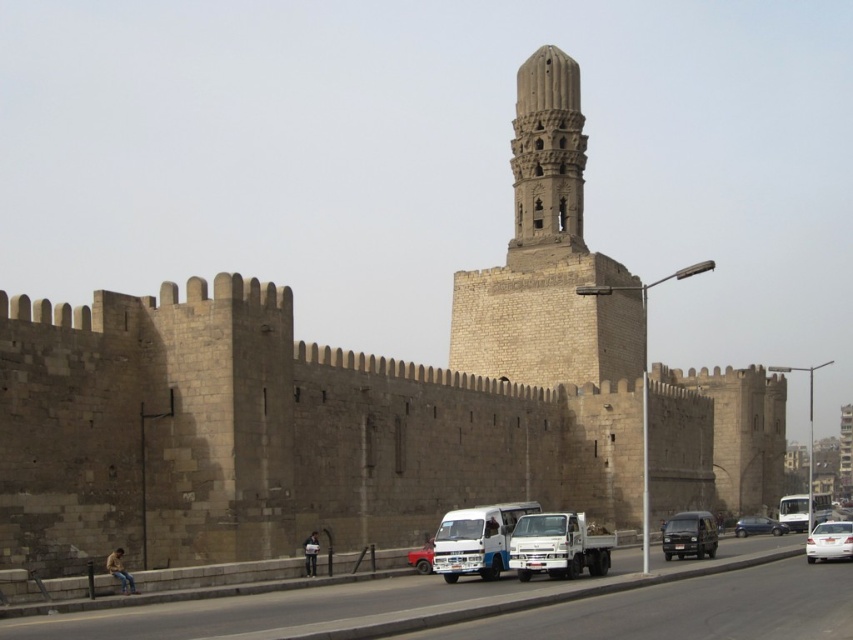
Does metallic blue sedan at lower right have a greater width compared to matte red truck at center?

Yes, metallic blue sedan at lower right is wider than matte red truck at center.

Does point (741, 531) come closer to viewer compared to point (418, 563)?

No, it is behind (418, 563).

Find the location of a particular element. This screenshot has width=853, height=640. metallic blue sedan at lower right is located at coordinates (758, 525).

Who is shorter, gray stone tower at center or dark gray matte van at lower right?

dark gray matte van at lower right is shorter.

From the picture: Is gray stone tower at center taller than dark gray matte van at lower right?

Indeed, gray stone tower at center has a greater height compared to dark gray matte van at lower right.

Who is more forward, (x=537, y=112) or (x=675, y=538)?

Point (x=675, y=538) is more forward.

I want to click on gray stone tower at center, so click(547, 154).

Is brown stone tower at center positioned in front of metallic blue sedan at lower right?

That is False.

Who is higher up, brown stone tower at center or metallic blue sedan at lower right?

brown stone tower at center is above.

What do you see at coordinates (547, 257) in the screenshot? I see `brown stone tower at center` at bounding box center [547, 257].

Locate an element on the screen. This screenshot has width=853, height=640. brown stone tower at center is located at coordinates (547, 257).